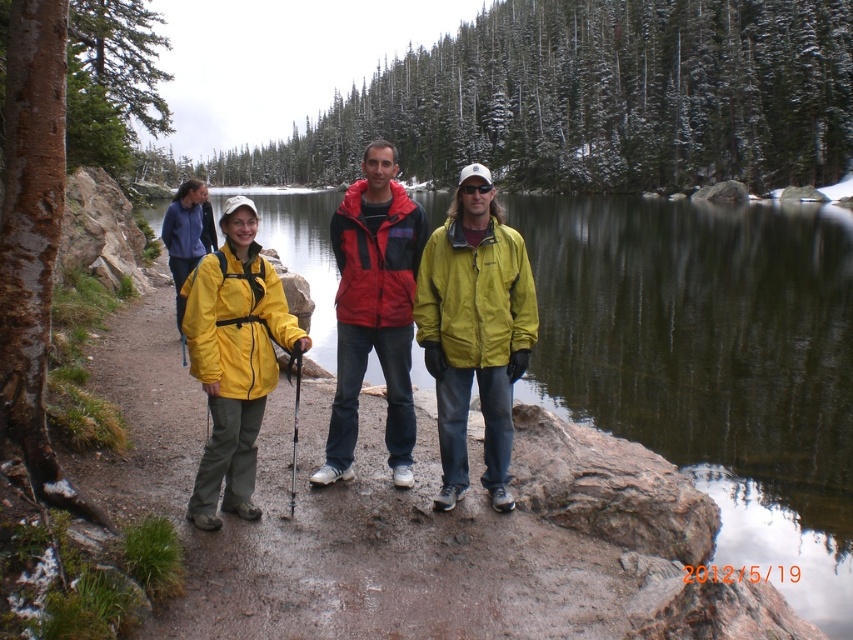
Question: Which object is closer to the camera taking this photo?

Choices:
 (A) yellow matte jacket at left
 (B) red/black jacket at center
 (C) matte yellow jacket at center
 (D) transparent water at center

Answer: (A)

Question: Can you confirm if transparent water at center is smaller than yellow matte jacket at left?

Choices:
 (A) yes
 (B) no

Answer: (B)

Question: Is transparent water at center thinner than matte yellow jacket at center?

Choices:
 (A) no
 (B) yes

Answer: (A)

Question: Estimate the real-world distances between objects in this image. Which object is closer to the transparent water at center?

Choices:
 (A) red/black jacket at center
 (B) yellow matte jacket at left

Answer: (B)

Question: Is the position of transparent water at center less distant than that of matte yellow jacket at center?

Choices:
 (A) yes
 (B) no

Answer: (B)

Question: Which object appears closest to the camera in this image?

Choices:
 (A) red/black jacket at center
 (B) matte yellow jacket at center

Answer: (B)